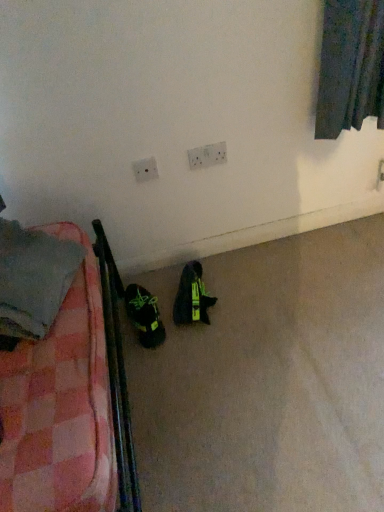
You are a GUI agent. You are given a task and a screenshot of the screen. Output one action in this format:
    pyautogui.click(x=<x>, y=<y>)
    Task: Click on the vacant area on the back side of green matte sneakers at lower left, positioned as the first footwear in left-to-right order
    The image size is (384, 512).
    Given the screenshot: What is the action you would take?
    145,282